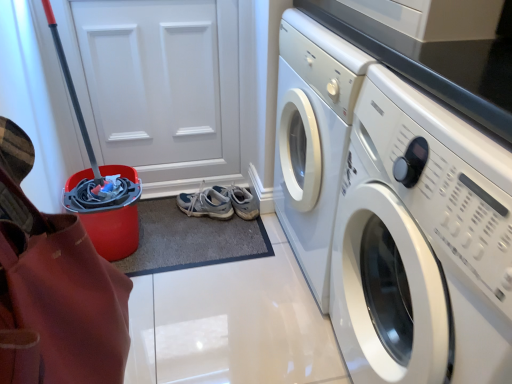
You are a GUI agent. You are given a task and a screenshot of the screen. Output one action in this format:
    pyautogui.click(x=<x>, y=<y>)
    Task: Click on the free space to the left of light gray fabric running shoe at center
    This screenshot has width=512, height=384.
    Given the screenshot: What is the action you would take?
    pyautogui.click(x=170, y=215)